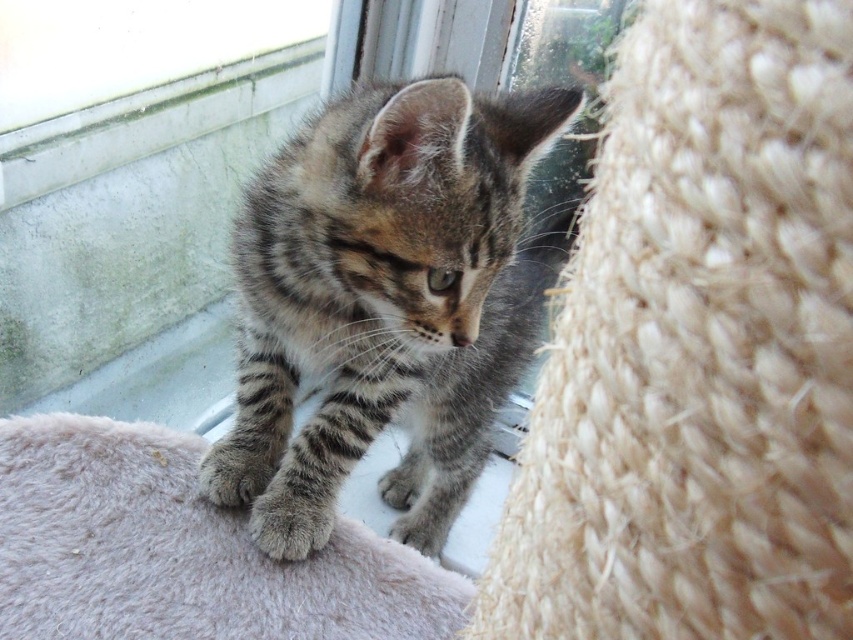
You are trying to determine if the striped fur kitten at center can fit on the fuzzy gray blanket at lower left. Based on their sizes, can it fit comfortably?

The striped fur kitten at center is narrower than the fuzzy gray blanket at lower left, so it should fit comfortably on the blanket.

You are a photographer trying to capture the kitten from the front. You notice two points in the scene marked as point 1 at coordinates (467,154) and point 2 at coordinates (271,556). Which point should you focus on to ensure the kitten is in sharp focus?

You should focus on point 1 at coordinates (467,154) because it is closer to the camera than point 2 at coordinates (271,556), ensuring the kitten is in sharp focus.

You are an animal caretaker observing a striped fur kitten at center and a soft fur paw at center. Which of these two has a greater width?

The striped fur kitten at center has a greater width than the soft fur paw at center.